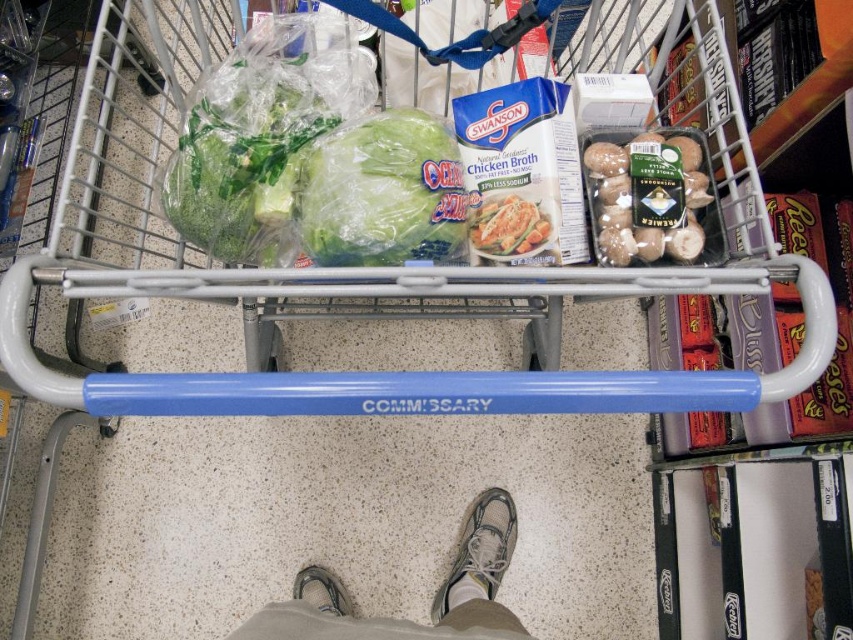
You are a customer in the commissary store and you want to place a small toy into your shopping cart. You have a matte plastic chicken at center and a gray fabric shoe at lower center. Which item can you place in the cart without it sticking out the top?

The matte plastic chicken at center is shorter than the gray fabric shoe at lower center, so the matte plastic chicken at center can be placed in the cart without sticking out the top.

You are a store employee who needs to place the gray fabric pants at lower center and the matte plastic chicken at center into a storage bin. The bin can only hold items that are narrower than the bin itself. If the bin is 12 inches wide, which item will fit better?

The matte plastic chicken at center will fit better in the bin since the gray fabric pants at lower center is wider than the matte plastic chicken at center, making the chicken narrower and thus more likely to fit within the 12 inch width.

You are standing in front of the shopping cart and want to pick up two items. The first item is located at point (497, 541) and the second item is at point (479, 244). Which item should you reach for first to minimize the distance you have to move your hand?

You should reach for the item at point (497, 541) first because it is closer to you than the item at point (479, 244). Since it is closer, you can grab it without moving your hand as far as you would need to for the other item.